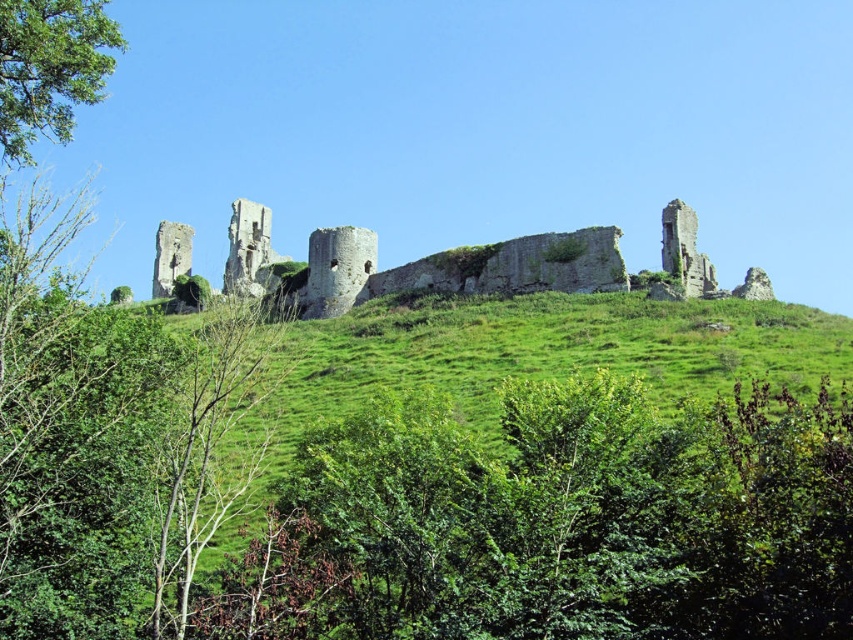
Between point (566, 282) and point (38, 20), which one is positioned in front?

Positioned in front is point (38, 20).

You are a GUI agent. You are given a task and a screenshot of the screen. Output one action in this format:
    pyautogui.click(x=<x>, y=<y>)
    Task: Click on the weathered stone ruins at center
    
    Given the screenshot: What is the action you would take?
    pyautogui.click(x=416, y=264)